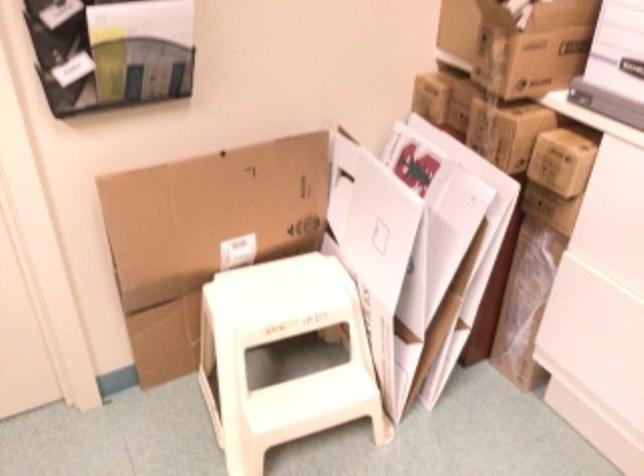
Where would you lift the white cardboard sheet? Please return your answer as a coordinate pair (x, y).

(453, 228)